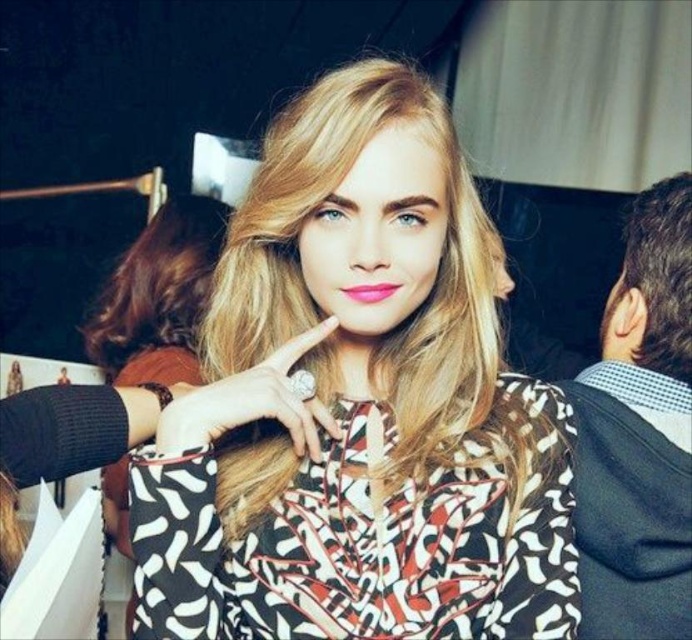
Between point (464, 467) and point (610, 300), which one is positioned in front?

Point (464, 467) is more forward.

Based on the photo, measure the distance from printed fabric dress at center to dark brown curly hair at right.

The distance of printed fabric dress at center from dark brown curly hair at right is 66.35 centimeters.

Is point (161, 586) closer to viewer compared to point (646, 256)?

That is True.

Where is `printed fabric dress at center`? Image resolution: width=692 pixels, height=640 pixels. printed fabric dress at center is located at coordinates (365, 541).

Who is lower down, printed fabric dress at center or black textured hoodie at right?

Positioned lower is printed fabric dress at center.

The height and width of the screenshot is (640, 692). I want to click on printed fabric dress at center, so click(x=365, y=541).

Is point (441, 634) farther from camera compared to point (646, 618)?

No, (441, 634) is closer to viewer.

At what (x,y) coordinates should I click in order to perform the action: click on printed fabric dress at center. Please return your answer as a coordinate pair (x, y). The width and height of the screenshot is (692, 640). Looking at the image, I should click on 365,541.

Who is shorter, blonde silky hair at upper left or matte pink lipstick at center?

matte pink lipstick at center is shorter.

Which is in front, point (172, 202) or point (374, 300)?

Positioned in front is point (374, 300).

This screenshot has width=692, height=640. In order to click on blonde silky hair at upper left in this screenshot , I will do `click(158, 284)`.